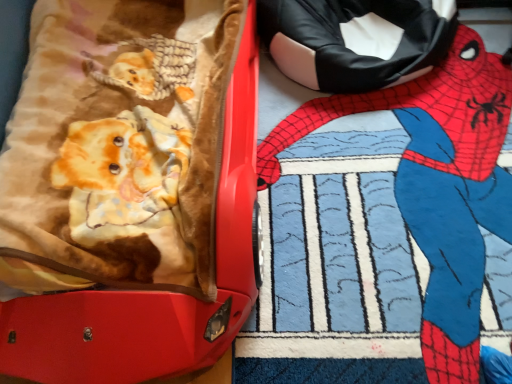
Question: Relative to matte red suitcase at left, is spider-man costume at upper right in front or behind?

Choices:
 (A) behind
 (B) front

Answer: (A)

Question: From a real-world perspective, is spider-man costume at upper right physically located above or below matte red suitcase at left?

Choices:
 (A) above
 (B) below

Answer: (B)

Question: From their relative heights in the image, would you say spider-man costume at upper right is taller or shorter than matte red suitcase at left?

Choices:
 (A) tall
 (B) short

Answer: (B)

Question: In terms of size, does matte red suitcase at left appear bigger or smaller than spider-man costume at upper right?

Choices:
 (A) big
 (B) small

Answer: (A)

Question: Considering the positions of matte red suitcase at left and spider-man costume at upper right in the image, is matte red suitcase at left wider or thinner than spider-man costume at upper right?

Choices:
 (A) thin
 (B) wide

Answer: (B)

Question: From the image's perspective, relative to spider-man costume at upper right, is matte red suitcase at left above or below?

Choices:
 (A) above
 (B) below

Answer: (A)

Question: From a real-world perspective, relative to spider-man costume at upper right, is matte red suitcase at left vertically above or below?

Choices:
 (A) above
 (B) below

Answer: (A)